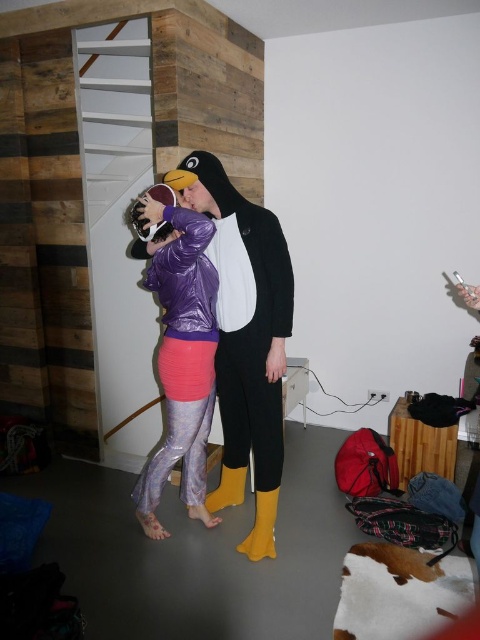
You are a photographer setting up a shoot in this room. You need to position a camera 20 inches away from the matte purple jacket at center to capture its details. Can you place the camera at the location of the yellow rubber boot at lower center?

The matte purple jacket at center and yellow rubber boot at lower center are 19.89 inches apart. Since the distance is less than 20 inches, placing the camera at the yellow rubber boot at lower center would be too close. You need to move the boot or camera further away to meet the 20 inches requirement.